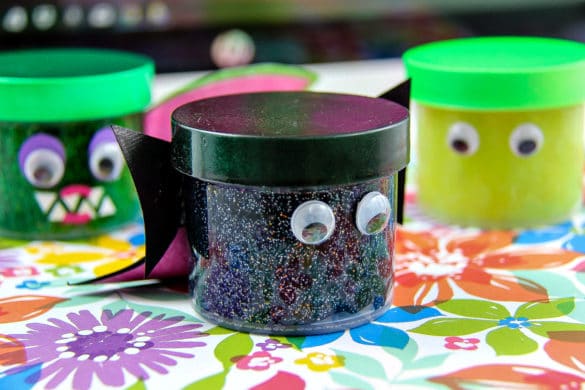
The image size is (585, 390). I want to click on pc screen, so click(x=209, y=9).